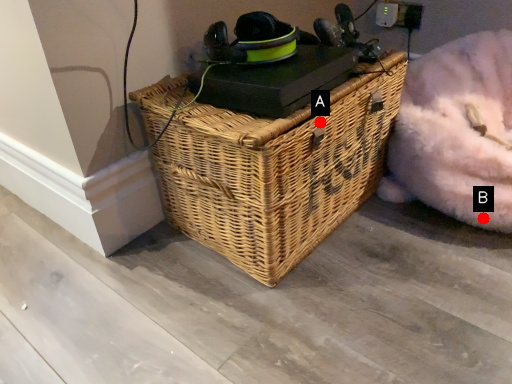
Question: Two points are circled on the image, labeled by A and B beside each circle. Which point is farther to the camera?

Choices:
 (A) A is further
 (B) B is further

Answer: (B)